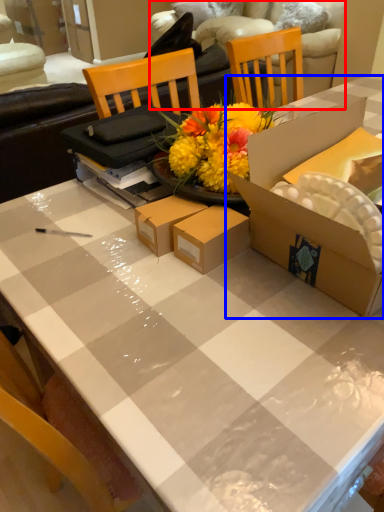
Question: Among these objects, which one is nearest to the camera, couch (highlighted by a red box) or box (highlighted by a blue box)?

Choices:
 (A) couch
 (B) box

Answer: (B)